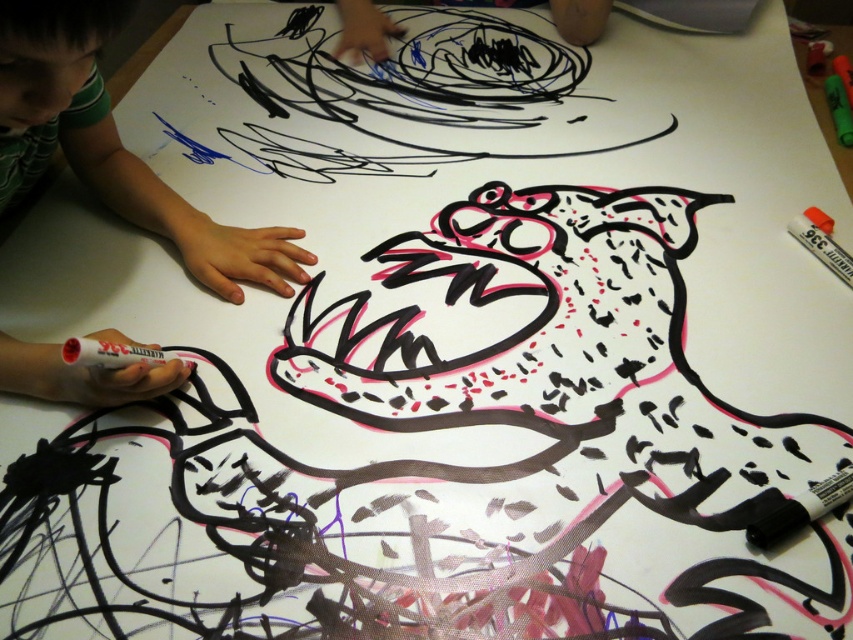
Which of these two, green matte skin at upper left or white matte sharpie at lower left, stands taller?

Standing taller between the two is green matte skin at upper left.

Does green matte skin at upper left have a larger size compared to white matte sharpie at lower left?

Correct, green matte skin at upper left is larger in size than white matte sharpie at lower left.

Is point (187, 371) positioned in front of point (160, 349)?

No, it is not.

Find the location of a particular element. This screenshot has width=853, height=640. green matte skin at upper left is located at coordinates (183, 218).

Does green matte skin at upper left come in front of white matte marker at upper right?

That is True.

Is green matte skin at upper left bigger than white matte marker at upper right?

Indeed, green matte skin at upper left has a larger size compared to white matte marker at upper right.

Between point (103, 392) and point (808, 237), which one is positioned in front?

Positioned in front is point (103, 392).

The width and height of the screenshot is (853, 640). I want to click on green matte skin at upper left, so click(x=183, y=218).

Measure the distance between white matte sharpie at lower left and camera.

They are 23.01 inches apart.

Does white matte sharpie at lower left appear under white matte marker at upper right?

Correct, white matte sharpie at lower left is located below white matte marker at upper right.

Image resolution: width=853 pixels, height=640 pixels. What do you see at coordinates (114, 355) in the screenshot?
I see `white matte sharpie at lower left` at bounding box center [114, 355].

The width and height of the screenshot is (853, 640). I want to click on white matte sharpie at lower left, so click(114, 355).